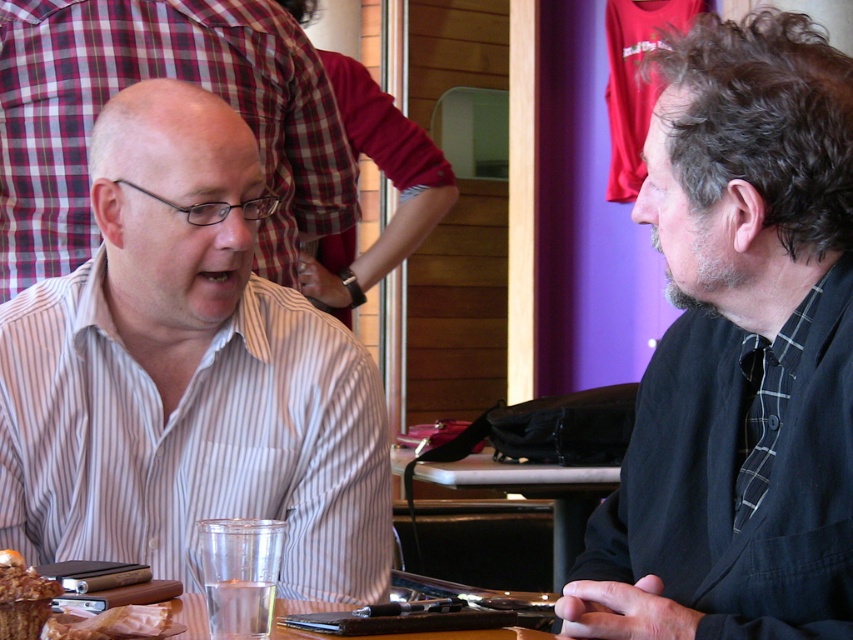
Question: Which is farther from the dark gray flannel shirt at right?

Choices:
 (A) wooden table at center
 (B) striped cotton shirt at left
 (C) golden brown bread at lower left

Answer: (A)

Question: From the image, what is the correct spatial relationship of striped cotton shirt at left in relation to dark gray flannel shirt at right?

Choices:
 (A) right
 (B) left

Answer: (B)

Question: Observing the image, what is the correct spatial positioning of wooden table at center in reference to golden brown bread at lower left?

Choices:
 (A) right
 (B) left

Answer: (A)

Question: Can you confirm if dark gray flannel shirt at right is positioned to the right of wooden table at center?

Choices:
 (A) yes
 (B) no

Answer: (A)

Question: Which is farther from the striped cotton shirt at left?

Choices:
 (A) golden brown bread at lower left
 (B) dark gray flannel shirt at right
 (C) chocolate cake at lower left

Answer: (B)

Question: Which of the following is the closest to the observer?

Choices:
 (A) (773, 122)
 (B) (6, 592)
 (C) (59, 636)

Answer: (B)